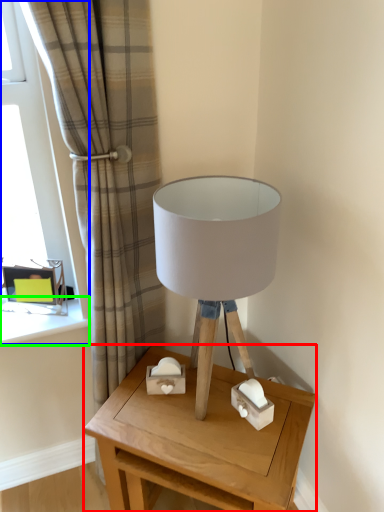
Question: Based on their relative distances, which object is farther from table (highlighted by a red box)? Choose from window (highlighted by a blue box) and window sill (highlighted by a green box).

Choices:
 (A) window
 (B) window sill

Answer: (A)